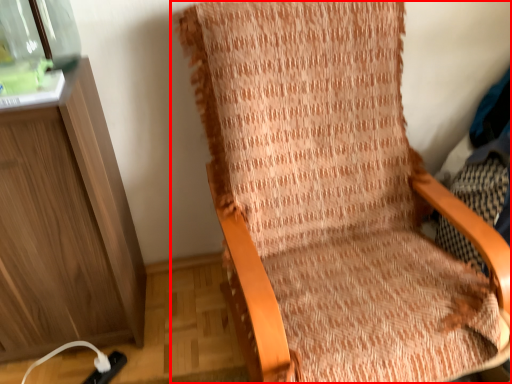
Question: From the image's perspective, considering the relative positions of chair (annotated by the red box) and glass jar in the image provided, where is chair (annotated by the red box) located with respect to the staircase?

Choices:
 (A) above
 (B) below

Answer: (B)